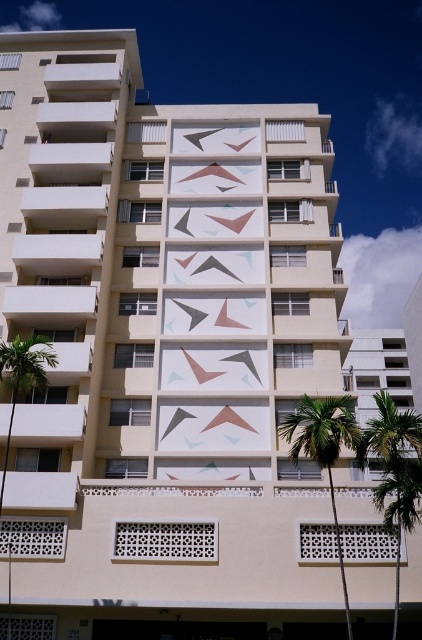
Question: Which point is closer to the camera?

Choices:
 (A) green leafy palm tree at right
 (B) green leafy palm tree at left

Answer: (A)

Question: Does green leafy palm tree at right appear under green leafy palm tree at left?

Choices:
 (A) no
 (B) yes

Answer: (B)

Question: Which is farther from the green leafy palm tree at lower right?

Choices:
 (A) green leafy palm tree at left
 (B) green leafy palm tree at right

Answer: (A)

Question: Is green leafy palm tree at lower right positioned behind green leafy palm tree at left?

Choices:
 (A) yes
 (B) no

Answer: (B)

Question: Among these objects, which one is nearest to the camera?

Choices:
 (A) green leafy palm tree at right
 (B) green leafy palm tree at left

Answer: (A)

Question: Can you confirm if green leafy palm tree at right is thinner than green leafy palm tree at lower right?

Choices:
 (A) yes
 (B) no

Answer: (B)